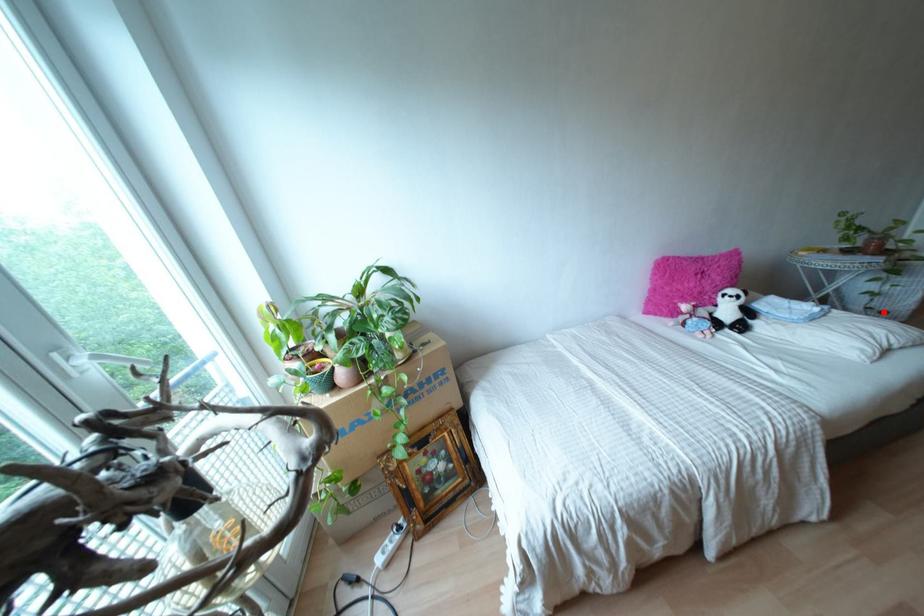
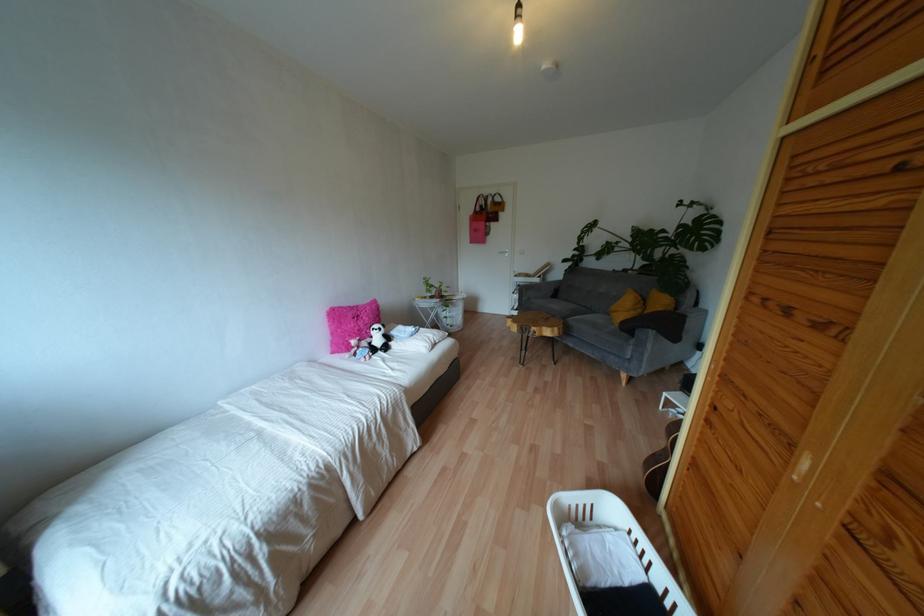
Question: A red point is marked in image1. In image2, is the corresponding 3D point closer to the camera or farther? Reply with the corresponding letter.

Choices:
 (A) The corresponding 3D point is closer.
 (B) The corresponding 3D point is farther.

Answer: (B)